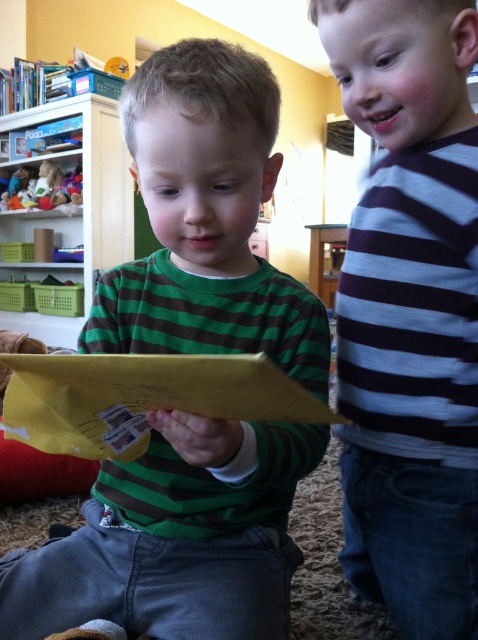
You are a photographer taking a picture of the two points in the image. Which point, point (115, 212) or point (57, 184), will appear larger in your photo?

Point (115, 212) is closer to the camera than point (57, 184), so it will appear larger in the photo.

Consider the image. You are a child trying to reach the wooden bookshelf at upper left to get a toy. There is a soft plush bear at upper left blocking your path. Can you move the bear to access the bookshelf?

The wooden bookshelf at upper left is to the right of the soft plush bear at upper left, so moving the bear might allow access to the bookshelf.